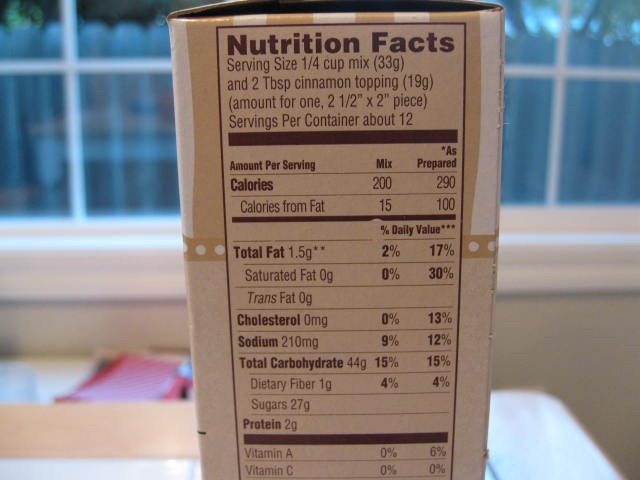
I want to click on white window sill, so click(x=122, y=275).